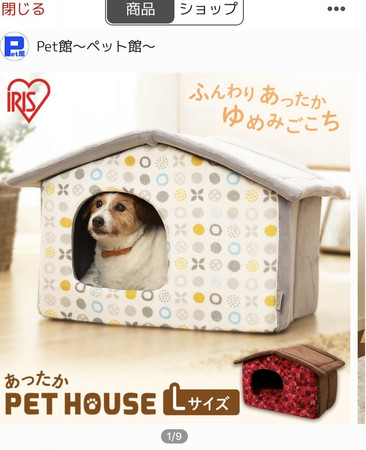
I want to click on frames, so click(x=333, y=271), click(x=362, y=268).